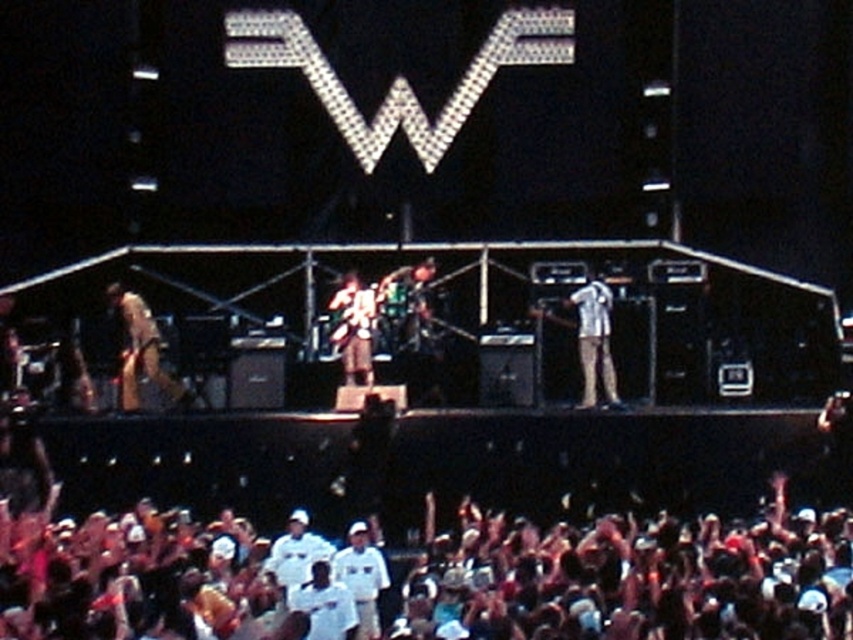
Question: Among these points, which one is nearest to the camera?

Choices:
 (A) (367, 342)
 (B) (608, 296)
 (C) (146, 376)

Answer: (B)

Question: Can you confirm if light brown leather guitar at left is wider than light blue denim jeans at center?

Choices:
 (A) no
 (B) yes

Answer: (B)

Question: Which point is closer to the camera?

Choices:
 (A) light blue denim jeans at center
 (B) dark brown leather jacket at center
 (C) light brown leather guitar at left

Answer: (A)

Question: Does light blue denim jeans at center come behind dark brown leather jacket at center?

Choices:
 (A) no
 (B) yes

Answer: (A)

Question: Among these points, which one is farthest from the camera?

Choices:
 (A) (604, 365)
 (B) (143, 326)

Answer: (B)

Question: Is light blue denim jeans at center positioned before dark brown leather jacket at center?

Choices:
 (A) yes
 (B) no

Answer: (A)